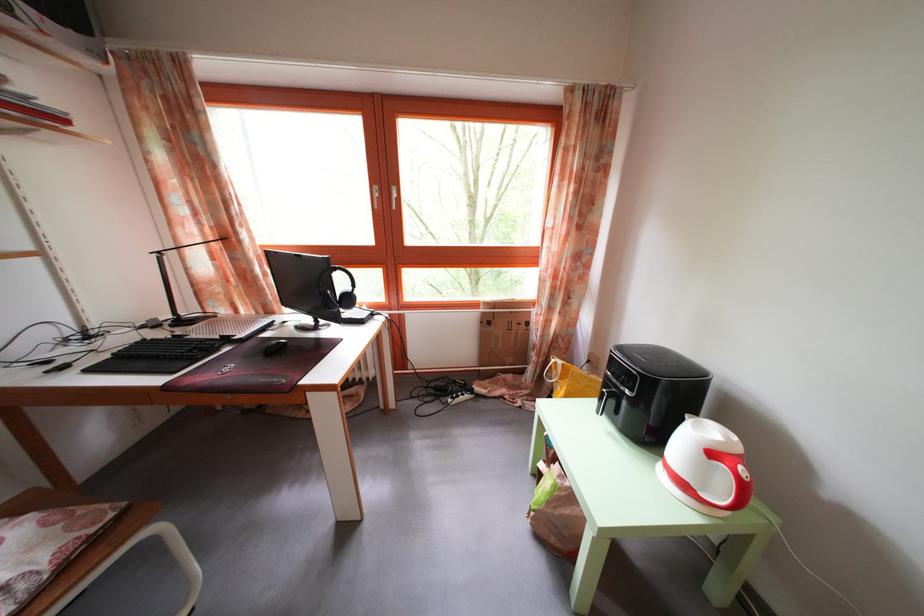
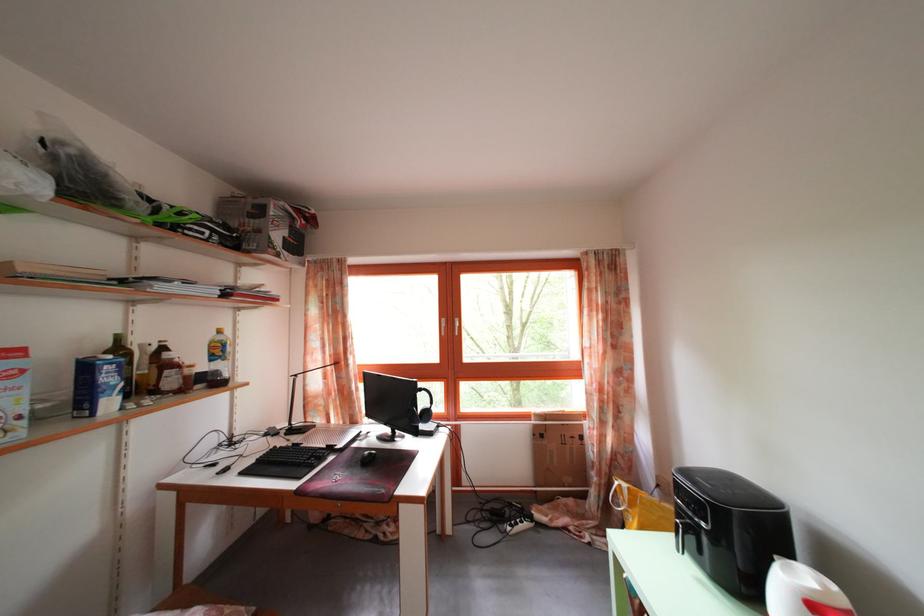
Locate, in the second image, the point that corresponds to point 491,321 in the first image.

(542, 432)